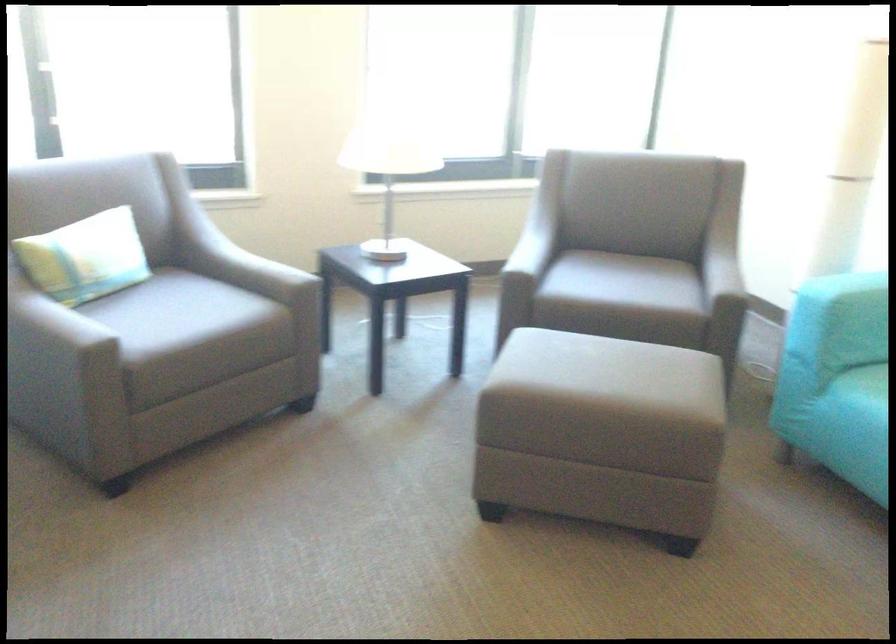
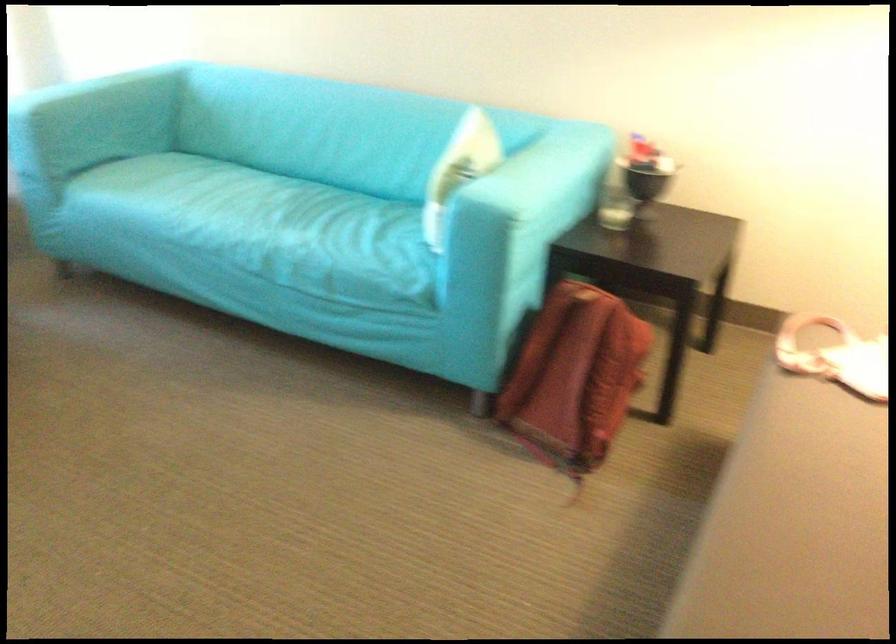
Question: The camera is either moving clockwise (left) or counter-clockwise (right) around the object. The first image is from the beginning of the video and the second image is from the end. Is the camera moving left or right when shooting the video?

Choices:
 (A) Left
 (B) Right

Answer: (A)